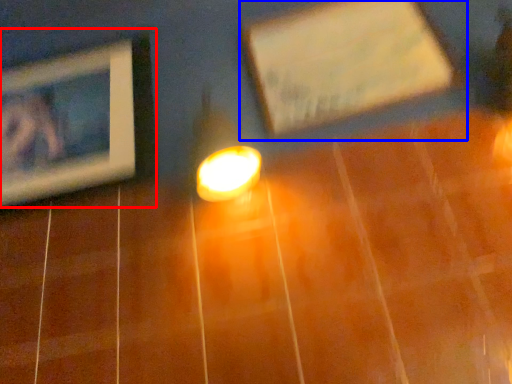
Question: Among these objects, which one is farthest to the camera, picture frame (highlighted by a red box) or picture frame (highlighted by a blue box)?

Choices:
 (A) picture frame
 (B) picture frame

Answer: (A)